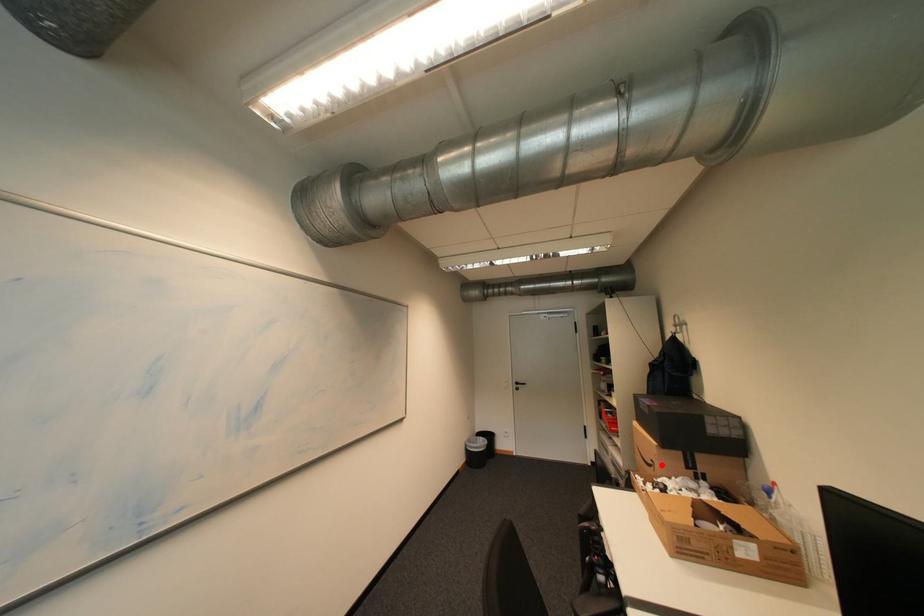
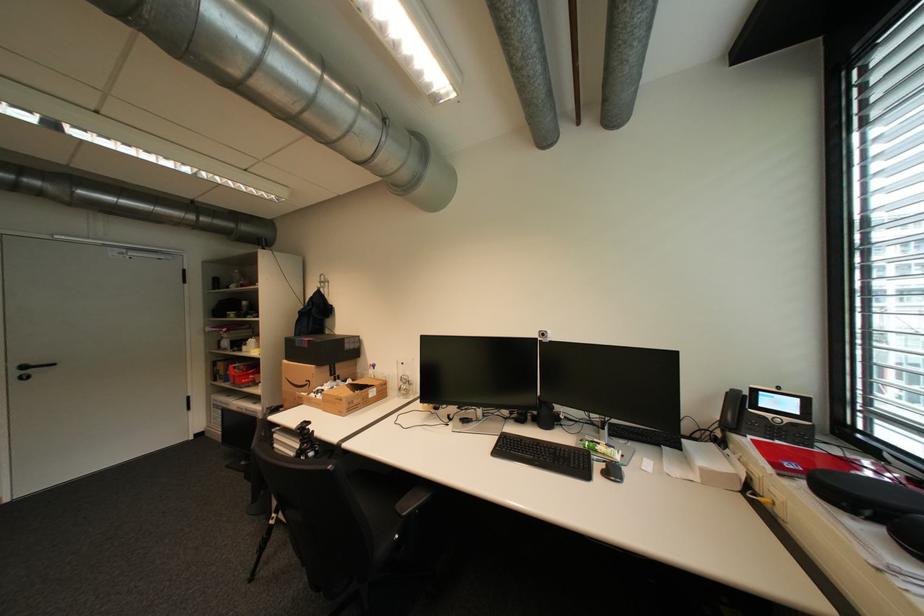
Question: I am providing you with two images of the same scene from different viewpoints. In image1, a red point is highlighted. Considering the same 3D point in image2, which of the following is correct?

Choices:
 (A) It is closer
 (B) It is farther

Answer: (B)